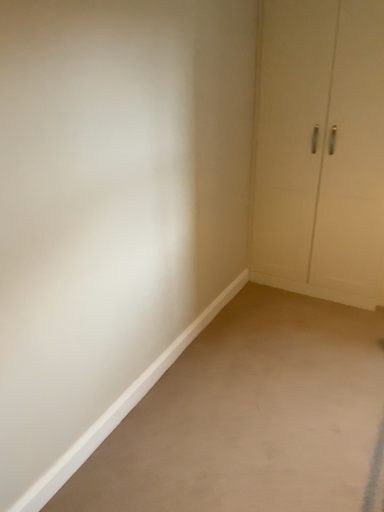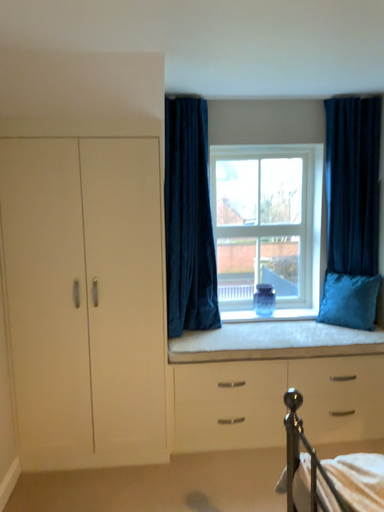
Question: Which way did the camera rotate in the video?

Choices:
 (A) rotated left
 (B) rotated right

Answer: (B)